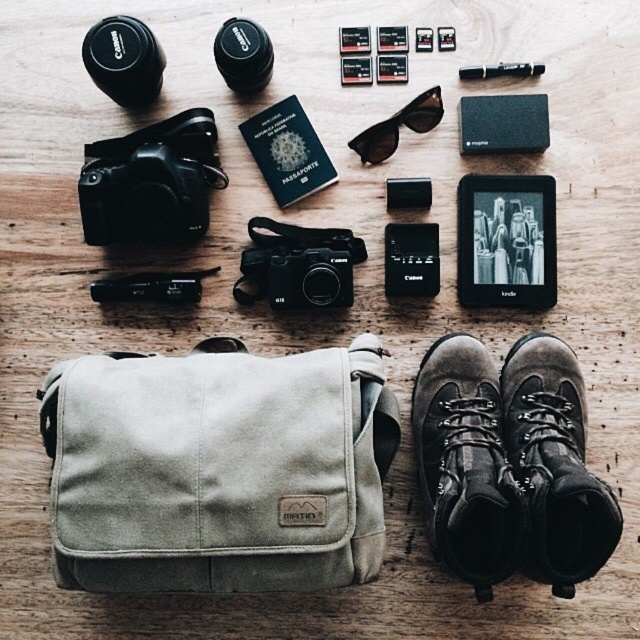
Question: Does leather boots at lower center appear over black matte passport at upper center?

Choices:
 (A) yes
 (B) no

Answer: (B)

Question: Considering the real-world distances, which object is closest to the black matte e-reader at center right?

Choices:
 (A) black plastic sunglasses at center
 (B) black plastic usb drive at center-left
 (C) black matte passport at upper center
 (D) metallic pen at upper center

Answer: (C)

Question: Is black matte e-reader at center right wider than metallic pen at upper center?

Choices:
 (A) yes
 (B) no

Answer: (A)

Question: Among these objects, which one is nearest to the camera?

Choices:
 (A) black leather boot at lower right
 (B) black plastic usb drive at center-left
 (C) black plastic sunglasses at center
 (D) black matte passport at center

Answer: (A)

Question: Is leather boots at lower center above black matte passport at center?

Choices:
 (A) no
 (B) yes

Answer: (A)

Question: Which object appears closest to the camera in this image?

Choices:
 (A) metallic pen at upper center
 (B) black matte e-reader at center right
 (C) canvas messenger bag at lower left
 (D) leather boots at lower center

Answer: (C)